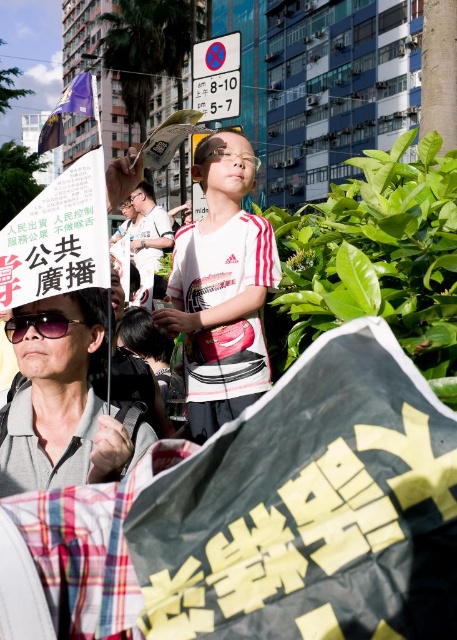
Does white matte shirt at center have a larger size compared to black matte sunglasses at lower left?

Yes, white matte shirt at center is bigger than black matte sunglasses at lower left.

Looking at this image, is white matte shirt at center wider than black matte sunglasses at lower left?

Yes.

At what (x,y) coordinates should I click in order to perform the action: click on white matte shirt at center. Please return your answer as a coordinate pair (x, y). The height and width of the screenshot is (640, 457). Looking at the image, I should click on (222, 289).

I want to click on white matte shirt at center, so tap(222, 289).

Can you confirm if white matte shirt at center is bigger than purple fabric flag at upper left?

No.

Based on the photo, who is more distant from viewer, (x=206, y=202) or (x=63, y=138)?

Positioned behind is point (x=206, y=202).

Is point (265, 224) closer to viewer compared to point (95, 90)?

No, it is behind (95, 90).

Find the location of a particular element. Image resolution: width=457 pixels, height=640 pixels. white matte shirt at center is located at coordinates coord(222,289).

Identify the location of matte gray shirt at lower left. (63, 400).

Find the location of a particular element. The image size is (457, 640). matte gray shirt at lower left is located at coordinates (63, 400).